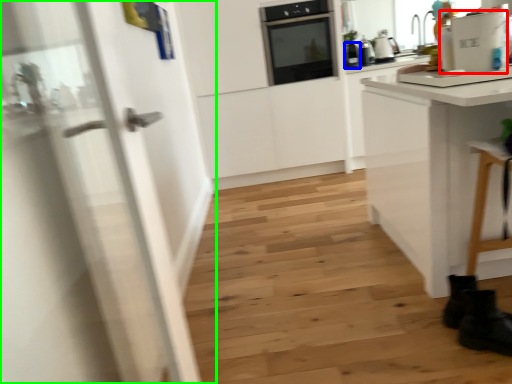
Question: Which object is positioned closest to appliance (highlighted by a red box)? Select from kitchen appliance (highlighted by a blue box) and door (highlighted by a green box).

Choices:
 (A) kitchen appliance
 (B) door

Answer: (B)